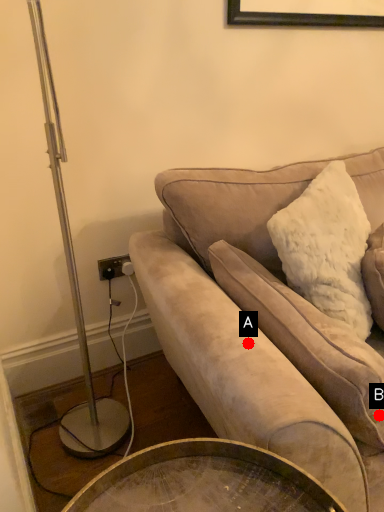
Question: Two points are circled on the image, labeled by A and B beside each circle. Which point is closer to the camera?

Choices:
 (A) A is closer
 (B) B is closer

Answer: (B)